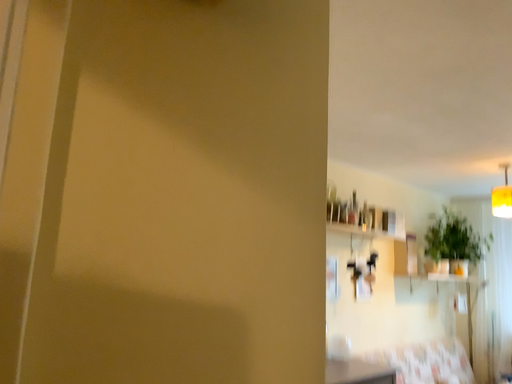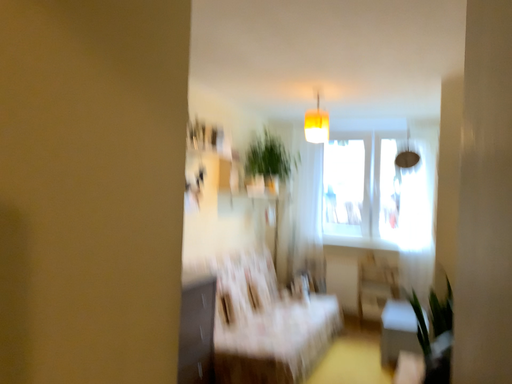
Question: How did the camera likely rotate when shooting the video?

Choices:
 (A) rotated left
 (B) rotated right

Answer: (B)